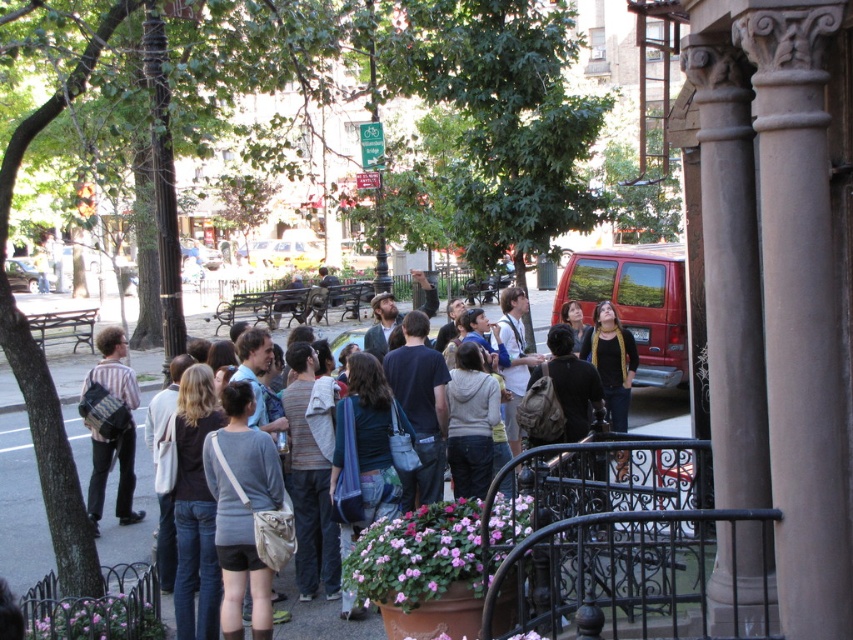
You are a delivery person needing to place a small package between the matte gray backpack at center and the striped cotton shirt at center. The package requires a space of 5 meters. Is there enough space between them?

The matte gray backpack at center is 6.10 meters from the striped cotton shirt at center, so yes, there is enough space between them to place the package since the distance exceeds the required 5 meters.

You are a photographer standing behind the black wrought iron railing in the foreground. You want to take a photo of the striped cotton shirt at center without the matte gray backpack at center blocking it. Is the backpack taller than the shirt?

The matte gray backpack at center is much taller than striped cotton shirt at center, so it will block the view of the striped cotton shirt at center.

You are a photographer setting up equipment in the park. You have a matte gray backpack at center that you need to place next to the smooth stone column at right. Based on their sizes, will the backpack fit next to the column without overlapping?

The smooth stone column at right is narrower than the matte gray backpack at center, so the backpack can be placed next to it without overlapping since there is sufficient space.